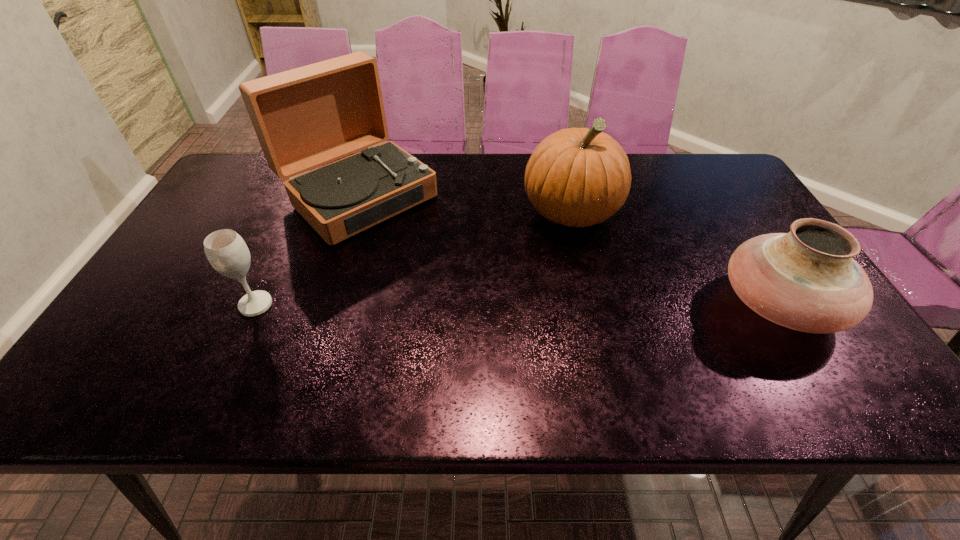
Locate an element on the screen. The width and height of the screenshot is (960, 540). free point located on the face of the phonograph record is located at coordinates (418, 248).

Identify the location of vacant space located 0.120m on the face of the phonograph record. (429, 258).

The width and height of the screenshot is (960, 540). Identify the location of pumpkin located at the far edge. (577, 177).

The width and height of the screenshot is (960, 540). What are the coordinates of `phonograph record present at the far edge` in the screenshot? It's located at (306, 117).

Locate an element on the screen. object at the near edge is located at coordinates (807, 280).

The width and height of the screenshot is (960, 540). I want to click on object at the right edge, so click(x=807, y=280).

Image resolution: width=960 pixels, height=540 pixels. I want to click on object present at the near right corner, so click(807, 280).

Find the location of a particular element. The width and height of the screenshot is (960, 540). free spot at the far edge of the desktop is located at coordinates (420, 154).

Find the location of `vacant space at the near edge of the desktop`. vacant space at the near edge of the desktop is located at coordinates (426, 339).

At what (x,y) coordinates should I click in order to perform the action: click on free space at the far right corner. Please return your answer as a coordinate pair (x, y). Looking at the image, I should click on (730, 185).